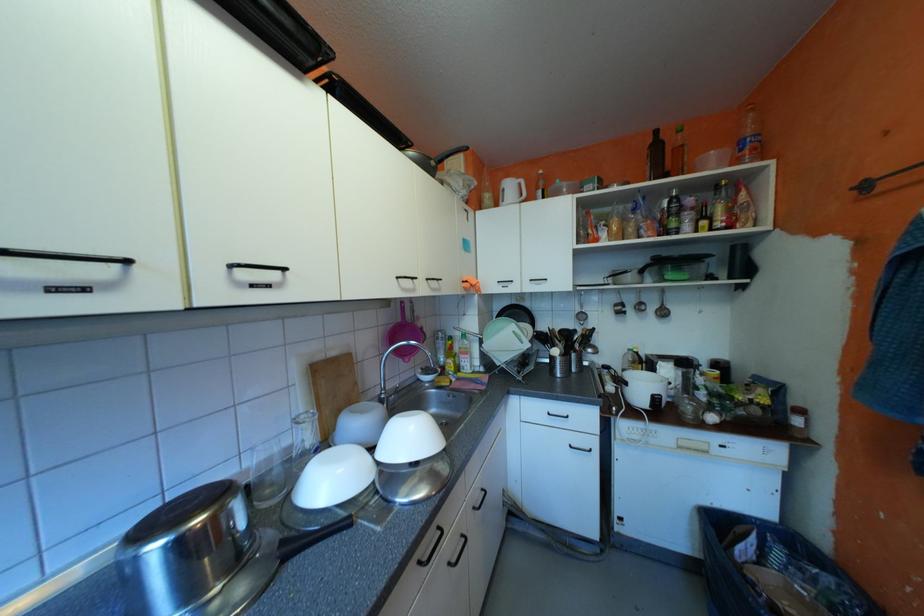
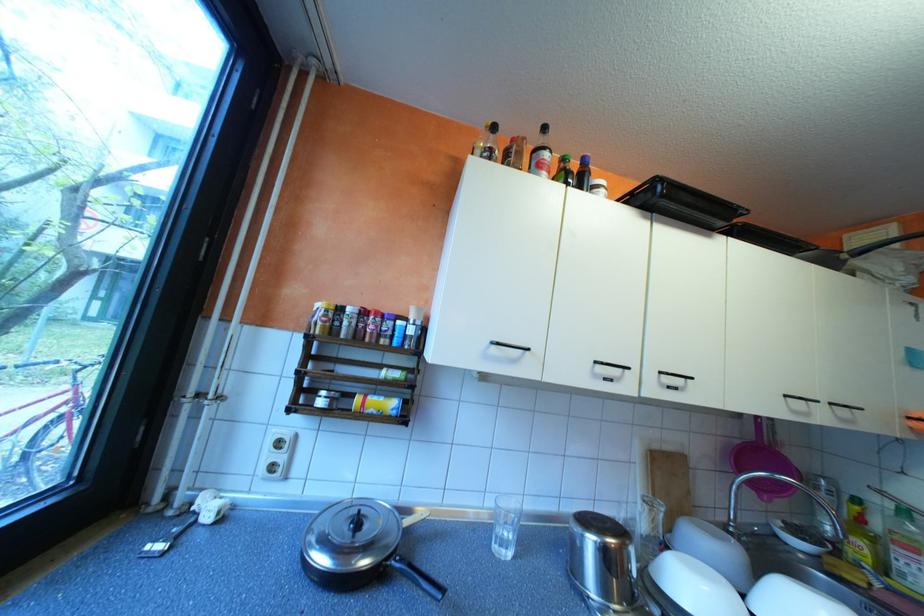
In the second image, find the point that corresponds to point (396, 392) in the first image.

(747, 525)